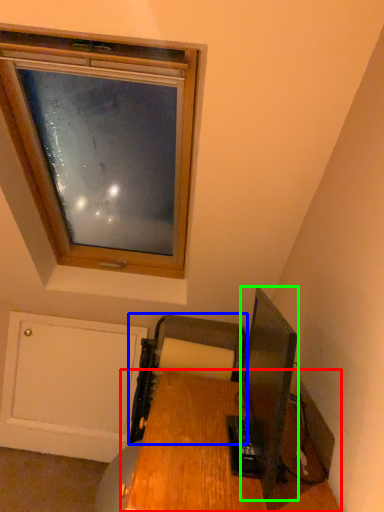
Question: Which is farther away from desk (highlighted by a red box)? printer (highlighted by a blue box) or television (highlighted by a green box)?

Choices:
 (A) printer
 (B) television

Answer: (B)